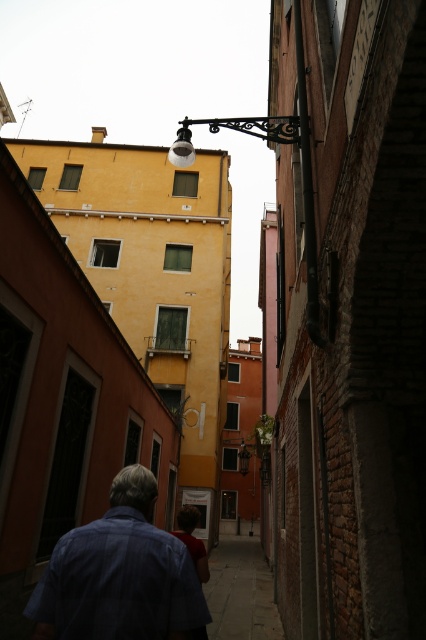
Question: Which of the following is the closest to the observer?

Choices:
 (A) [x=255, y=548]
 (B) [x=98, y=572]

Answer: (B)

Question: Where is blue cotton shirt at lower left located in relation to paved stone sidewalk at center in the image?

Choices:
 (A) left
 (B) right

Answer: (A)

Question: Can you confirm if blue cotton shirt at lower left is smaller than paved stone sidewalk at center?

Choices:
 (A) no
 (B) yes

Answer: (B)

Question: Observing the image, what is the correct spatial positioning of blue cotton shirt at lower left in reference to paved stone sidewalk at center?

Choices:
 (A) above
 (B) below

Answer: (A)